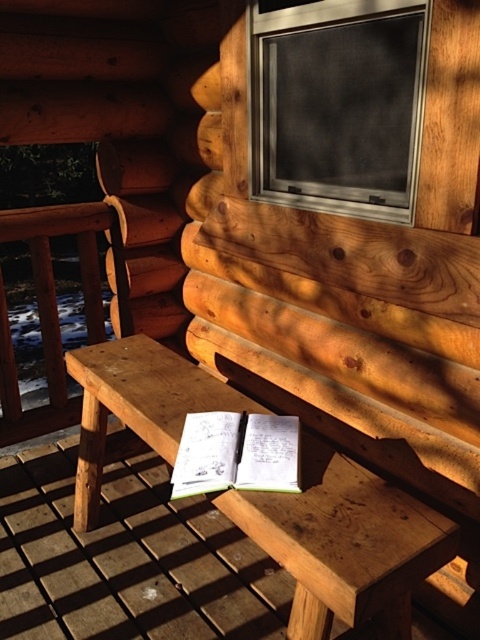
Question: Which of the following is the closest to the observer?

Choices:
 (A) (375, 45)
 (B) (148, 346)

Answer: (A)

Question: Can you confirm if natural wood picnic table at center is positioned below metallic mesh window at upper center?

Choices:
 (A) yes
 (B) no

Answer: (A)

Question: Is natural wood picnic table at center to the left of metallic mesh window at upper center from the viewer's perspective?

Choices:
 (A) yes
 (B) no

Answer: (A)

Question: Does natural wood picnic table at center lie behind metallic mesh window at upper center?

Choices:
 (A) yes
 (B) no

Answer: (B)

Question: Which point appears closest to the camera in this image?

Choices:
 (A) (427, 32)
 (B) (425, 561)

Answer: (B)